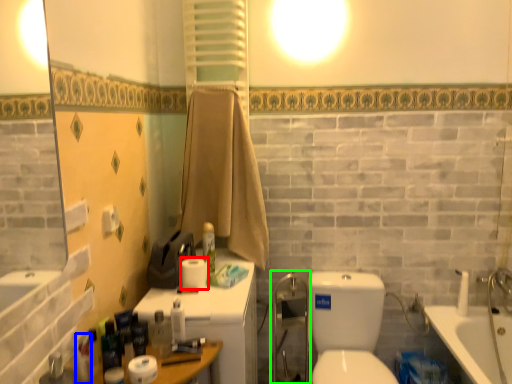
Question: Based on their relative distances, which object is farther from toilet paper (highlighted by a red box)? Choose from toiletry (highlighted by a blue box) and shower door (highlighted by a green box).

Choices:
 (A) toiletry
 (B) shower door

Answer: (B)